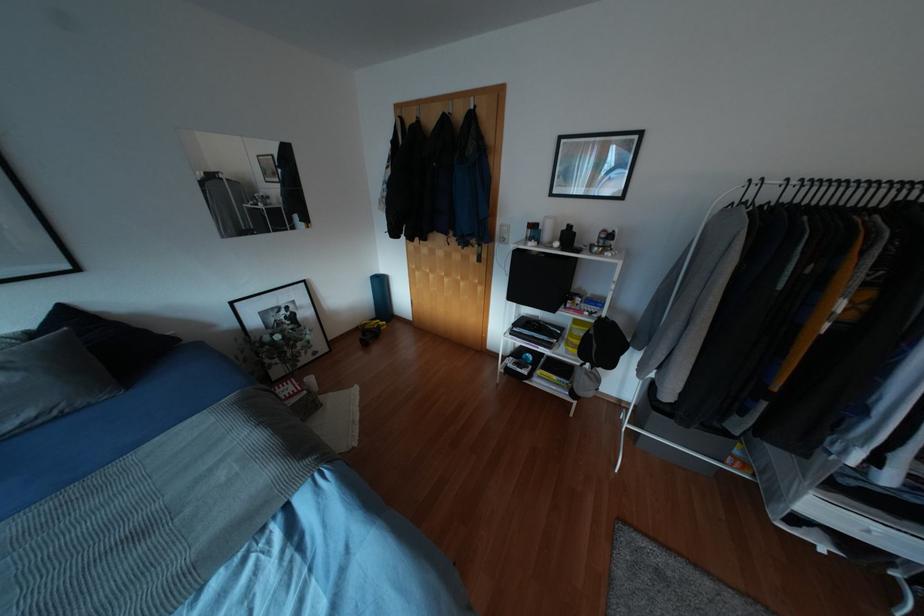
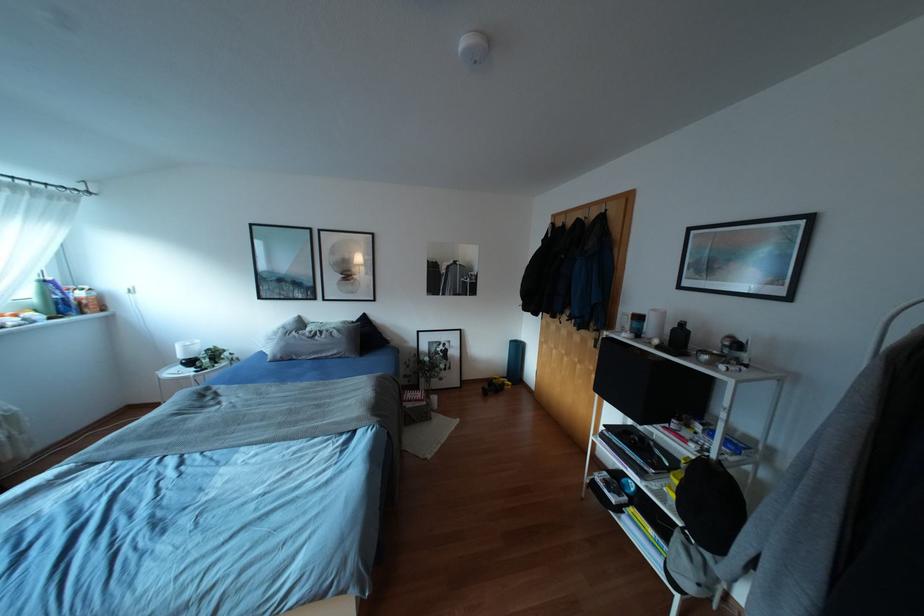
The point at (66, 313) is marked in the first image. Where is the corresponding point in the second image?

(363, 317)